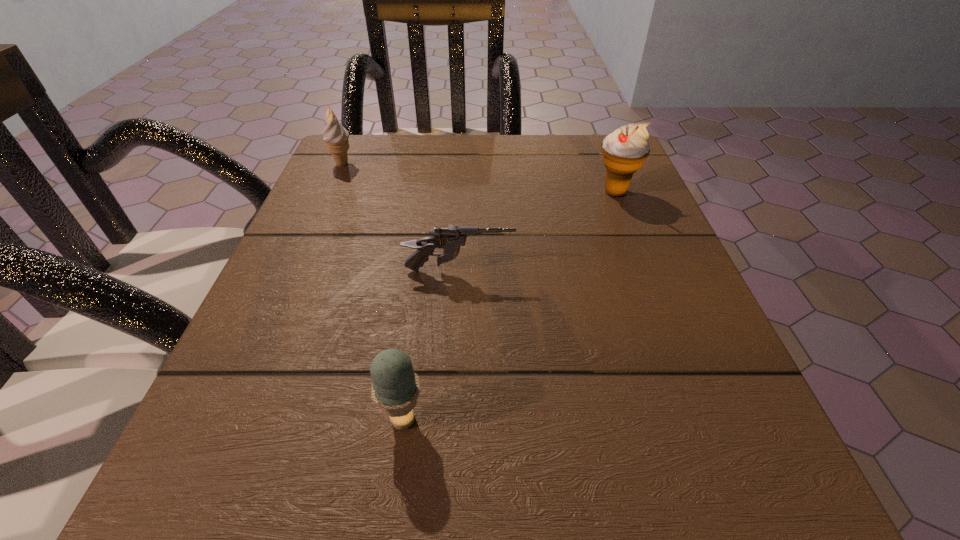
Locate an element on the screen. The image size is (960, 540). the tallest object is located at coordinates point(624,151).

What are the coordinates of `the rightmost ice cream` in the screenshot? It's located at (624, 151).

Find the location of a particular element. Image resolution: width=960 pixels, height=540 pixels. the farthest object is located at coordinates (335, 136).

Where is `the leftmost ice cream`? the leftmost ice cream is located at coordinates (335, 136).

Locate an element on the screen. This screenshot has width=960, height=540. the second ice cream from right to left is located at coordinates (395, 388).

Identify the location of the nearest object. (395, 388).

Locate an element on the screen. the shortest object is located at coordinates (450, 239).

Image resolution: width=960 pixels, height=540 pixels. Find the location of `gun`. gun is located at coordinates (450, 239).

This screenshot has height=540, width=960. I want to click on free space located 0.210m on the left of the second farthest object, so click(488, 192).

Locate an element on the screen. This screenshot has height=540, width=960. vacant space situated on the front-facing side of the leftmost object is located at coordinates (405, 164).